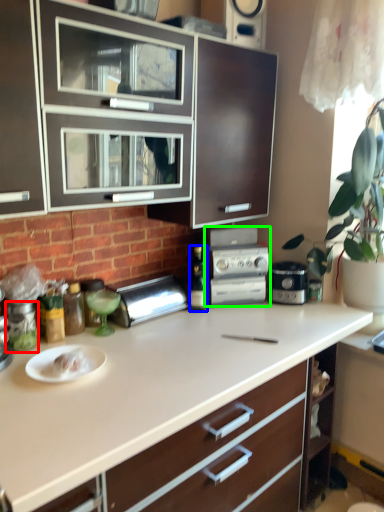
Question: Based on their relative distances, which object is farther from appliance (highlighted by a red box)? Choose from bottle (highlighted by a blue box) and kitchen appliance (highlighted by a green box).

Choices:
 (A) bottle
 (B) kitchen appliance

Answer: (B)